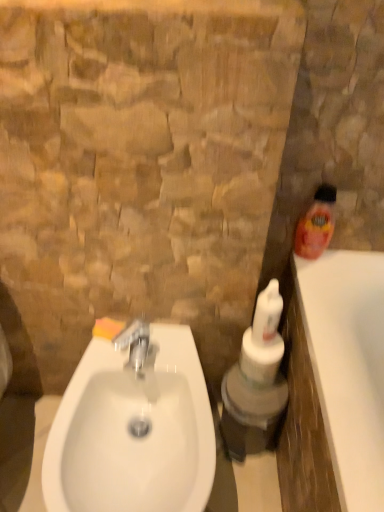
Question: From the image's perspective, relative to white glossy sink at lower left, is white glossy bottle at center, the first cleaning product when ordered from bottom to top, above or below?

Choices:
 (A) above
 (B) below

Answer: (A)

Question: Based on their positions, is white glossy bottle at center, the first cleaning product when ordered from bottom to top, located to the left or right of white glossy sink at lower left?

Choices:
 (A) left
 (B) right

Answer: (B)

Question: Which object is positioned closest to the white glossy sink at lower left?

Choices:
 (A) silver metallic faucet at center
 (B) orange sponge at sink left
 (C) white glossy bottle at center, which is the 2th cleaning product in top-to-bottom order
 (D) orange plastic bottle at right, the 1th cleaning product viewed from the right

Answer: (A)

Question: Which is nearer to the silver metallic faucet at center?

Choices:
 (A) white glossy sink at lower left
 (B) white glossy bottle at center, marked as the 2th cleaning product in a right-to-left arrangement
 (C) orange sponge at sink left
 (D) orange plastic bottle at right, the second cleaning product in the left-to-right sequence

Answer: (C)